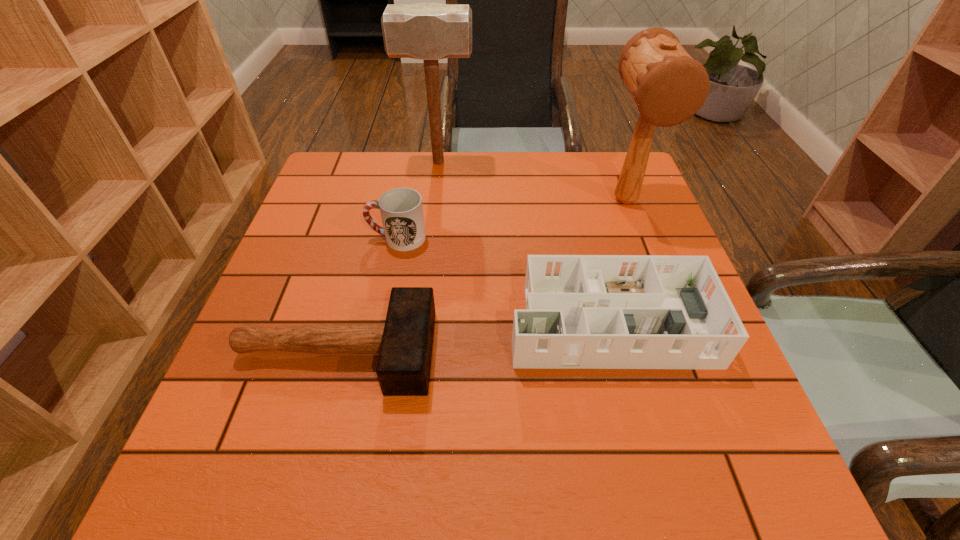
Locate an element on the screen. This screenshot has width=960, height=540. vacant space at the right edge of the desktop is located at coordinates (653, 217).

In the image, there is a desktop. At what (x,y) coordinates should I click in order to perform the action: click on vacant area at the far right corner. Please return your answer as a coordinate pair (x, y). Image resolution: width=960 pixels, height=540 pixels. Looking at the image, I should click on (617, 161).

Locate an element on the screen. Image resolution: width=960 pixels, height=540 pixels. vacant space at the near right corner of the desktop is located at coordinates (725, 456).

Identify the location of free space that is in between the nearest mallet and the dollhouse. The height and width of the screenshot is (540, 960). (471, 333).

Locate an element on the screen. Image resolution: width=960 pixels, height=540 pixels. free spot between the dollhouse and the cup is located at coordinates (502, 276).

At what (x,y) coordinates should I click in order to perform the action: click on free space between the rightmost mallet and the shortest object. Please return your answer as a coordinate pair (x, y). The width and height of the screenshot is (960, 540). Looking at the image, I should click on (481, 276).

Identify the location of unoccupied position between the cup and the shortest object. The width and height of the screenshot is (960, 540). (367, 295).

Find the location of a particular element. Image resolution: width=960 pixels, height=540 pixels. object that can be found as the fourth closest to the cup is located at coordinates (668, 86).

Locate an element on the screen. This screenshot has width=960, height=540. object that stands as the fourth closest to the shortest mallet is located at coordinates (426, 31).

I want to click on mallet that stands as the second closest to the nearest mallet, so [426, 31].